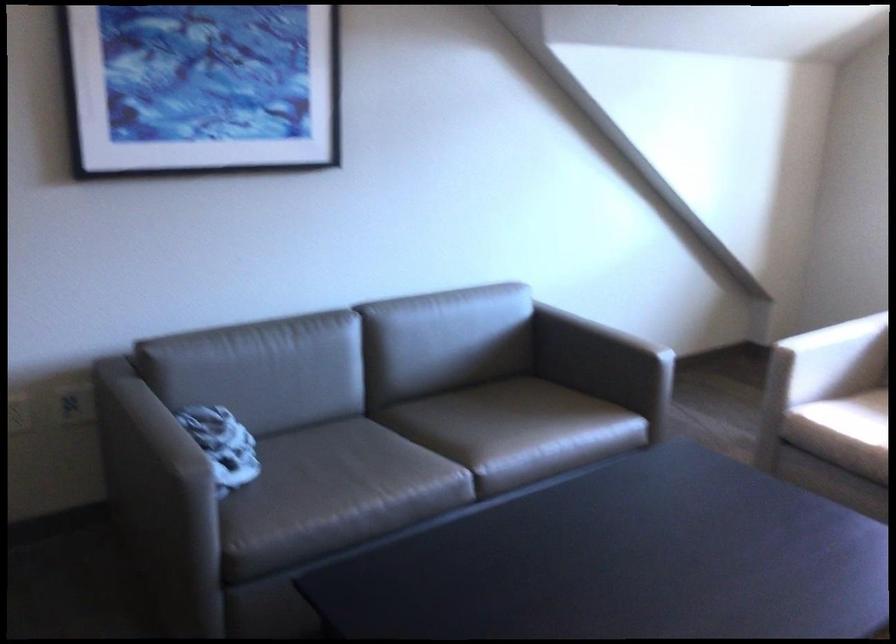
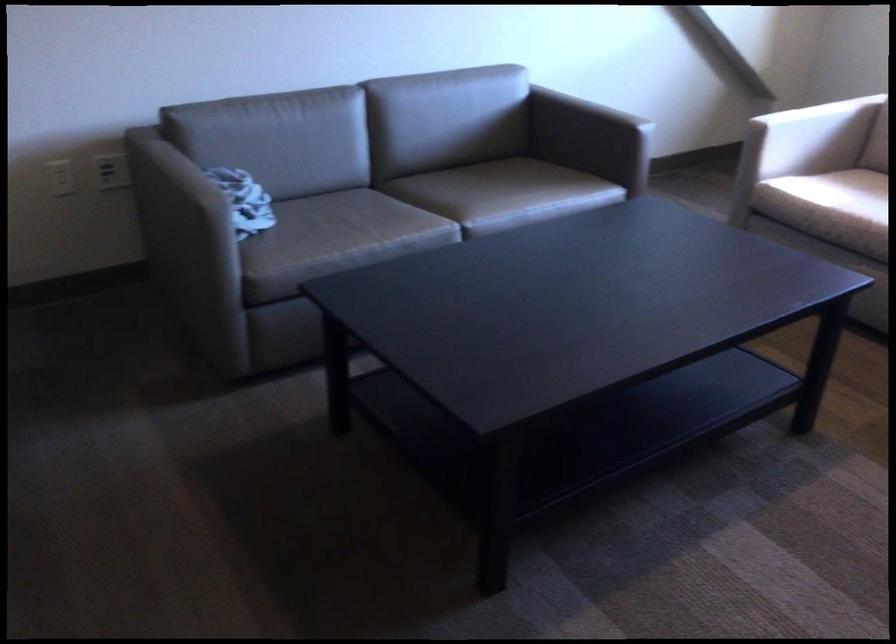
The point at (607,303) is marked in the first image. Where is the corresponding point in the second image?

(605, 93)